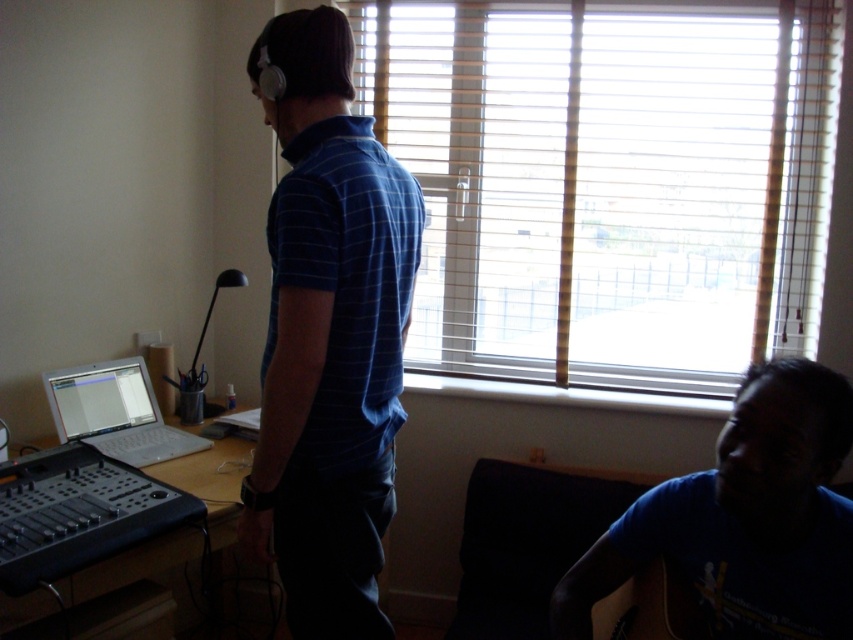
Question: Estimate the real-world distances between objects in this image. Which object is farther from the wooden blinds at upper center?

Choices:
 (A) silver metallic laptop at left
 (B) blue plaid shirt at center

Answer: (B)

Question: Which point is farther to the camera?

Choices:
 (A) [x=538, y=42]
 (B) [x=65, y=394]
 (C) [x=682, y=550]

Answer: (A)

Question: Which object is the farthest from the silver metallic laptop at left?

Choices:
 (A) wooden blinds at upper center
 (B) blue plaid shirt at center
 (C) silver glossy laptop at lower left

Answer: (A)

Question: Can you confirm if wooden blinds at upper center is positioned below blue cotton shirt at lower right?

Choices:
 (A) yes
 (B) no

Answer: (B)

Question: Is silver metallic laptop at left positioned in front of silver glossy laptop at lower left?

Choices:
 (A) no
 (B) yes

Answer: (B)

Question: Is blue cotton shirt at lower right below silver metallic laptop at left?

Choices:
 (A) yes
 (B) no

Answer: (A)